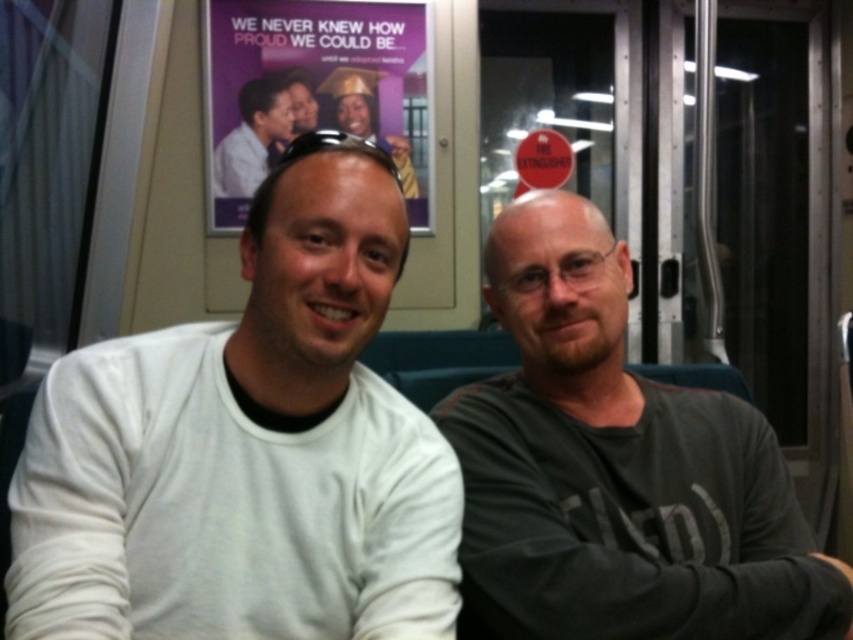
Question: Which point is farther to the camera?

Choices:
 (A) purple paper poster at upper center
 (B) matte gray shirt at upper center
 (C) white matte shirt at center
 (D) dark gray cotton shirt at center

Answer: (B)

Question: Considering the relative positions of purple paper poster at upper center and matte gray shirt at upper center in the image provided, where is purple paper poster at upper center located with respect to matte gray shirt at upper center?

Choices:
 (A) above
 (B) below

Answer: (A)

Question: Considering the real-world distances, which object is closest to the purple paper poster at upper center?

Choices:
 (A) dark gray cotton shirt at center
 (B) matte gray shirt at upper center

Answer: (B)

Question: Is the position of dark gray cotton shirt at center more distant than that of matte gray shirt at upper center?

Choices:
 (A) yes
 (B) no

Answer: (B)

Question: Which point is farther to the camera?

Choices:
 (A) purple paper poster at upper center
 (B) dark gray cotton shirt at center

Answer: (A)

Question: Does purple paper poster at upper center appear on the left side of matte gray shirt at upper center?

Choices:
 (A) no
 (B) yes

Answer: (A)